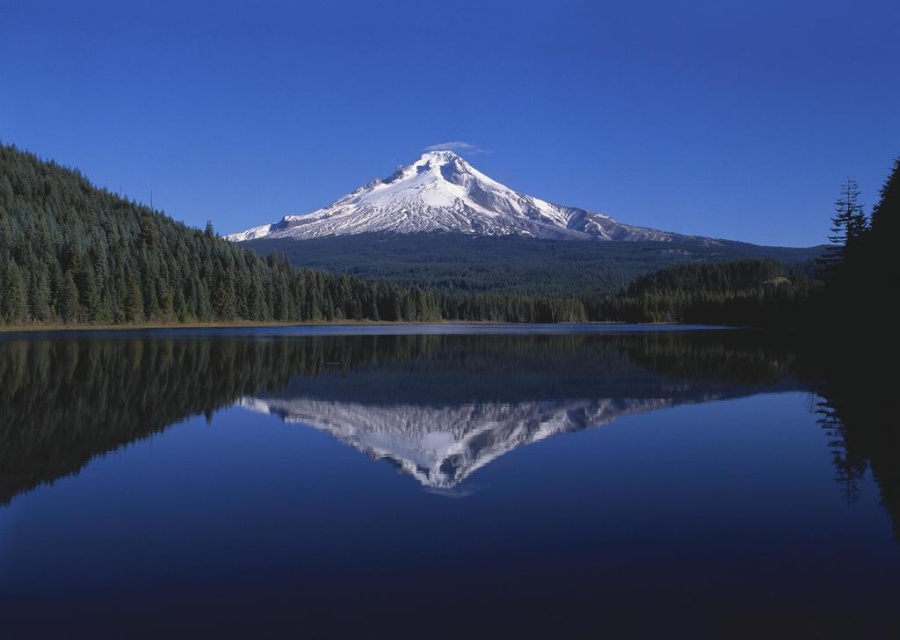
Which is above, white snow-covered mountain at center or green matte tree at upper right?

green matte tree at upper right is above.

Between white snow-covered mountain at center and green matte tree at upper right, which one has more height?

With more height is green matte tree at upper right.

Find the location of `white snow-covered mountain at center`. white snow-covered mountain at center is located at coordinates (453, 211).

Is transparent glass water at center wider than green matte tree at upper right?

No, transparent glass water at center is not wider than green matte tree at upper right.

Can you confirm if transparent glass water at center is positioned to the right of green matte tree at upper right?

In fact, transparent glass water at center is to the left of green matte tree at upper right.

Where is `transparent glass water at center`? This screenshot has height=640, width=900. transparent glass water at center is located at coordinates (441, 486).

The width and height of the screenshot is (900, 640). I want to click on transparent glass water at center, so click(x=441, y=486).

Who is positioned more to the left, transparent glass water at center or white snow-covered mountain at center?

From the viewer's perspective, transparent glass water at center appears more on the left side.

Between transparent glass water at center and white snow-covered mountain at center, which one has less height?

transparent glass water at center is shorter.

Is point (106, 536) farther from camera compared to point (381, 221)?

No.

Locate an element on the screen. This screenshot has width=900, height=640. transparent glass water at center is located at coordinates (441, 486).